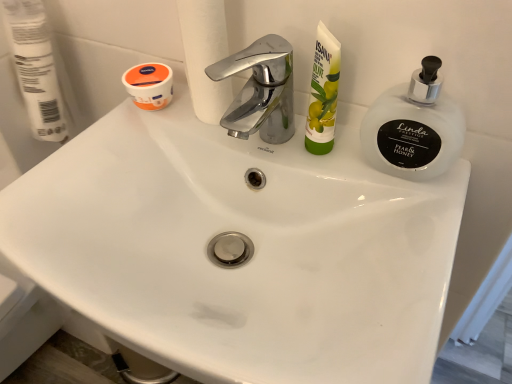
Locate an element on the screen. vacant area situated to the left side of white matte toilet paper at upper center, which ranks as the 1th toilet paper in right-to-left order is located at coordinates (x=103, y=147).